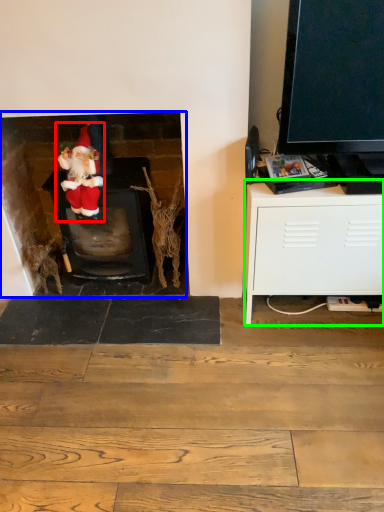
Question: Considering the real-world distances, which object is farthest from person (highlighted by a red box)? fireplace (highlighted by a blue box) or cabinetry (highlighted by a green box)?

Choices:
 (A) fireplace
 (B) cabinetry

Answer: (B)